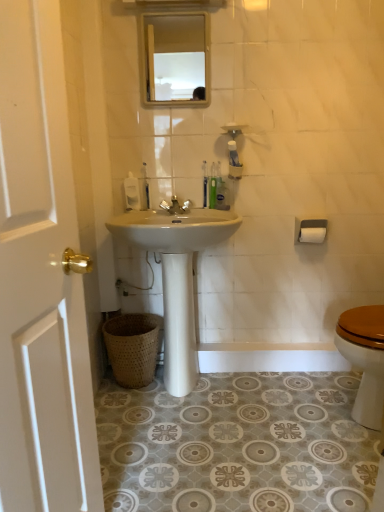
Where is `blank space above brown woven basket at lower left (from a real-world perspective)`? The width and height of the screenshot is (384, 512). blank space above brown woven basket at lower left (from a real-world perspective) is located at coordinates (130, 321).